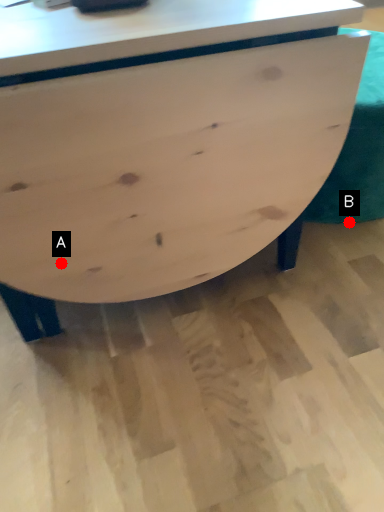
Question: Two points are circled on the image, labeled by A and B beside each circle. Which point appears farthest from the camera in this image?

Choices:
 (A) A is further
 (B) B is further

Answer: (B)